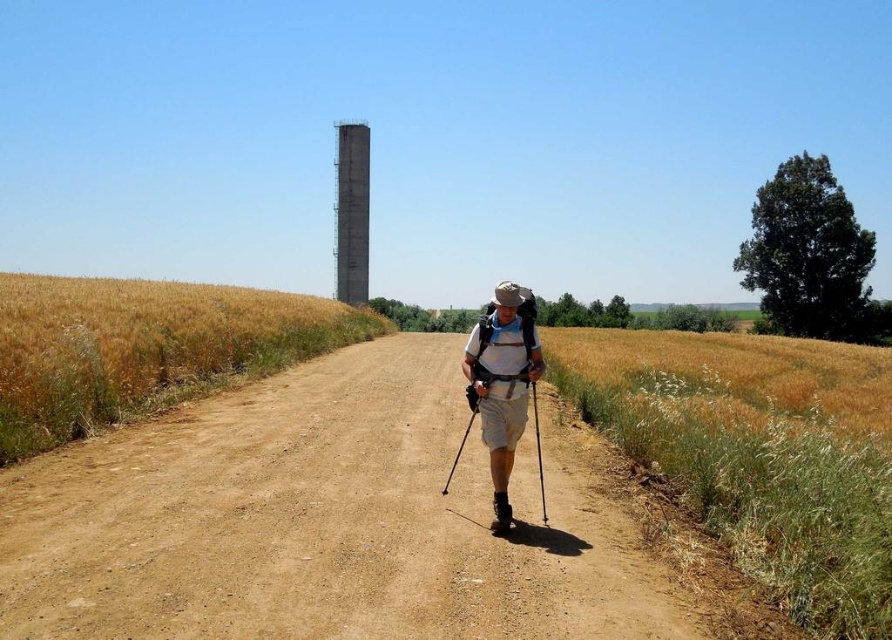
Question: Estimate the real-world distances between objects in this image. Which object is farther from the concrete tower at upper center?

Choices:
 (A) matte khaki shorts at center
 (B) dirt road at center
 (C) golden wheat field at left

Answer: (A)

Question: Does golden wheat field at left appear on the left side of matte khaki shorts at center?

Choices:
 (A) yes
 (B) no

Answer: (A)

Question: Does dirt road at center come in front of concrete tower at upper center?

Choices:
 (A) yes
 (B) no

Answer: (A)

Question: Is dirt road at center positioned behind concrete tower at upper center?

Choices:
 (A) no
 (B) yes

Answer: (A)

Question: Among these objects, which one is nearest to the camera?

Choices:
 (A) concrete tower at upper center
 (B) matte khaki shorts at center

Answer: (B)

Question: Based on their relative distances, which object is farther from the golden wheat field at left?

Choices:
 (A) dirt road at center
 (B) matte khaki shorts at center
 (C) concrete tower at upper center

Answer: (C)